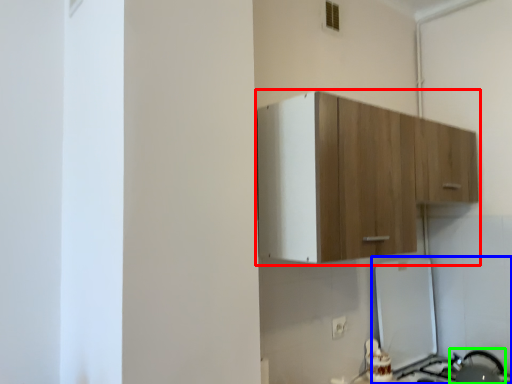
Question: Estimate the real-world distances between objects in this image. Which object is closer to cabinetry (highlighted by a red box), appliance (highlighted by a blue box) or appliance (highlighted by a green box)?

Choices:
 (A) appliance
 (B) appliance

Answer: (A)